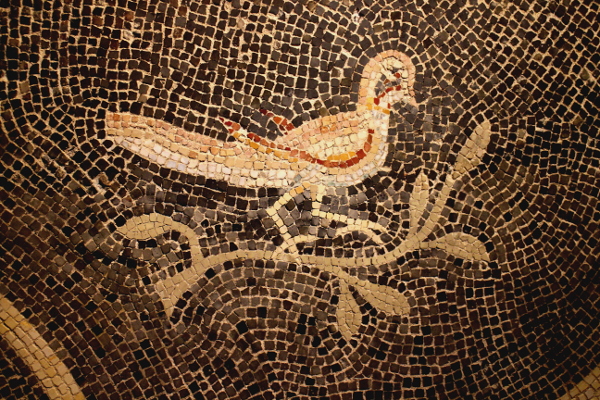
You are a GUI agent. You are given a task and a screenshot of the screen. Output one action in this format:
    pyautogui.click(x=<x>, y=<y>)
    Task: Click on the white tile
    This screenshot has width=600, height=400.
    Given the screenshot: What is the action you would take?
    pyautogui.click(x=279, y=191), pyautogui.click(x=280, y=182)